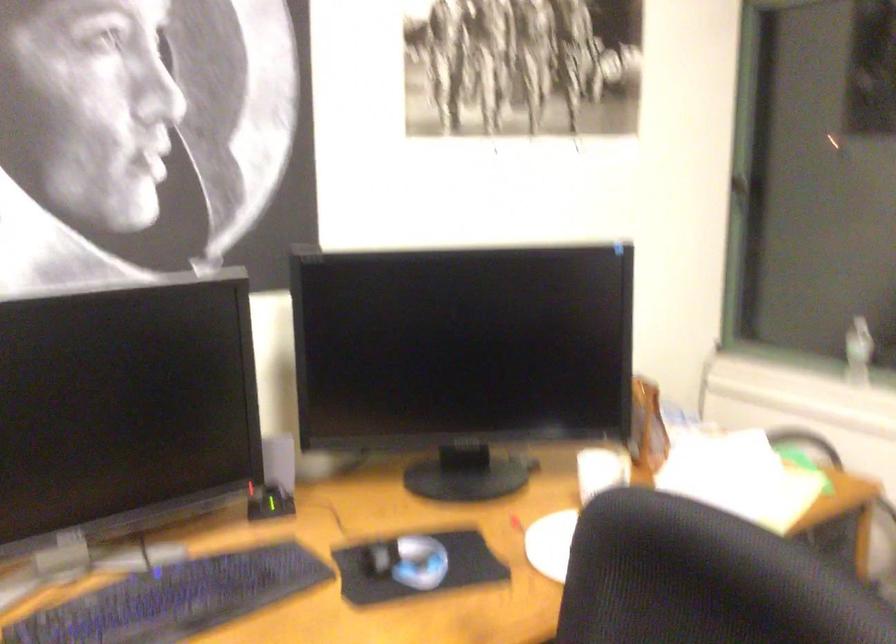
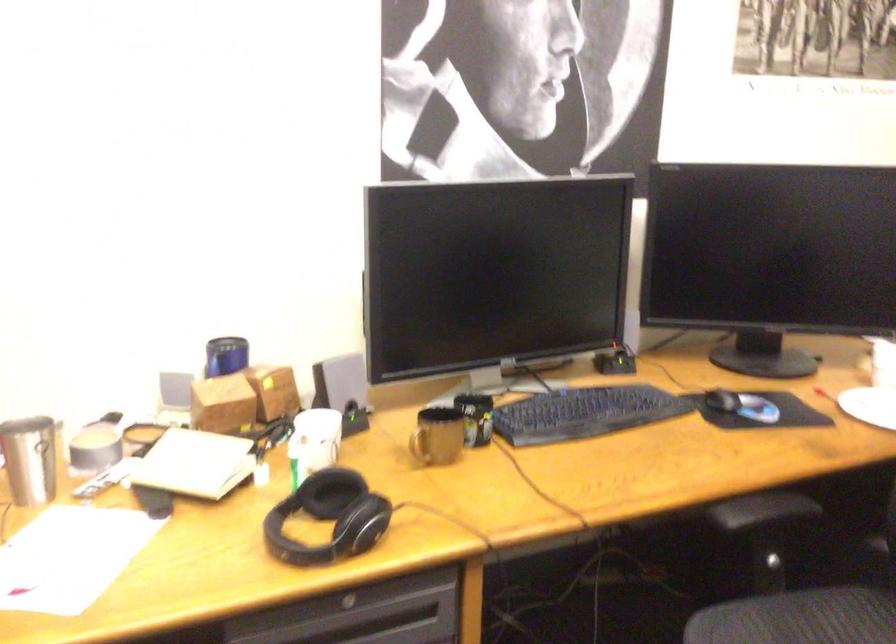
The point at (372, 569) is marked in the first image. Where is the corresponding point in the second image?

(721, 400)